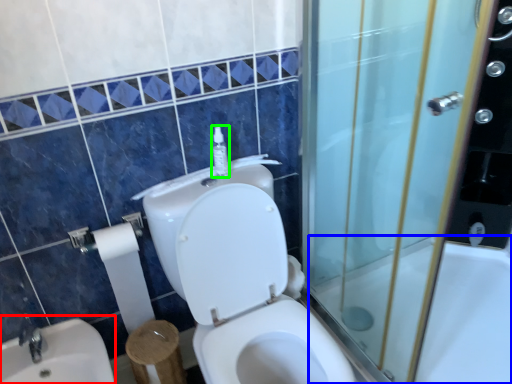
Question: Based on their relative distances, which object is nearer to sink (highlighted by a red box)? Choose from bath (highlighted by a blue box) and soap dispenser (highlighted by a green box).

Choices:
 (A) bath
 (B) soap dispenser

Answer: (B)